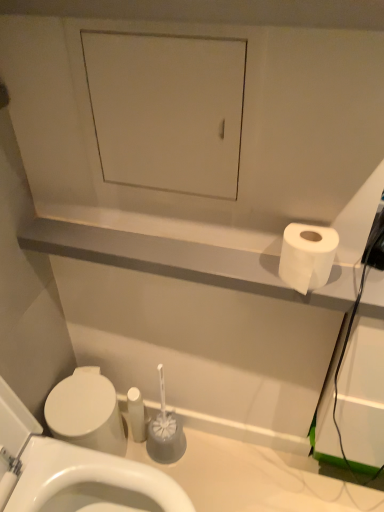
Question: Considering the relative positions of white matte cabinet at upper center and white glossy toilet at lower left in the image provided, is white matte cabinet at upper center to the left of white glossy toilet at lower left from the viewer's perspective?

Choices:
 (A) yes
 (B) no

Answer: (B)

Question: Would you say white glossy toilet at lower left is part of white matte cabinet at upper center's contents?

Choices:
 (A) no
 (B) yes

Answer: (A)

Question: Are white matte cabinet at upper center and white glossy toilet at lower left located far from each other?

Choices:
 (A) yes
 (B) no

Answer: (B)

Question: Does white matte cabinet at upper center come behind white glossy toilet at lower left?

Choices:
 (A) no
 (B) yes

Answer: (B)

Question: Is white matte cabinet at upper center smaller than white glossy toilet at lower left?

Choices:
 (A) no
 (B) yes

Answer: (B)

Question: Based on their positions, is white matte cabinet at upper center located to the left or right of white glossy toilet at lower left?

Choices:
 (A) left
 (B) right

Answer: (B)

Question: Considering the positions of point (183, 88) and point (26, 493), is point (183, 88) closer or farther from the camera than point (26, 493)?

Choices:
 (A) farther
 (B) closer

Answer: (B)

Question: From a real-world perspective, is white matte cabinet at upper center physically located above or below white glossy toilet at lower left?

Choices:
 (A) above
 (B) below

Answer: (A)

Question: In terms of size, does white matte cabinet at upper center appear bigger or smaller than white glossy toilet at lower left?

Choices:
 (A) big
 (B) small

Answer: (B)

Question: Do you think white matte cabinet at upper center is within white matte toilet paper at right, or outside of it?

Choices:
 (A) outside
 (B) inside

Answer: (A)

Question: Does point (137, 159) appear closer or farther from the camera than point (301, 227)?

Choices:
 (A) farther
 (B) closer

Answer: (A)

Question: From the image's perspective, is white matte cabinet at upper center above or below white matte toilet paper at right?

Choices:
 (A) below
 (B) above

Answer: (B)

Question: From a real-world perspective, relative to white matte toilet paper at right, is white matte cabinet at upper center vertically above or below?

Choices:
 (A) above
 (B) below

Answer: (A)

Question: In terms of height, does white matte toilet paper at right look taller or shorter compared to white matte cabinet at upper center?

Choices:
 (A) short
 (B) tall

Answer: (A)

Question: Considering their positions, is white matte toilet paper at right located in front of or behind white matte cabinet at upper center?

Choices:
 (A) front
 (B) behind

Answer: (B)